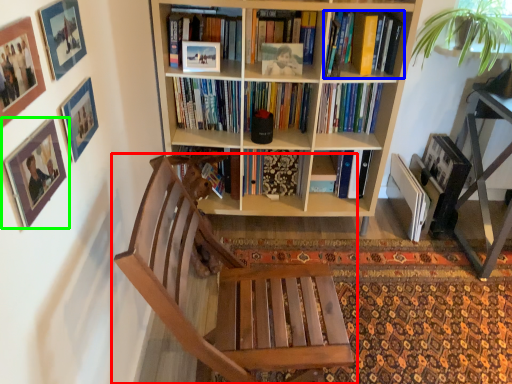
Question: Which object is positioned closest to chair (highlighted by a red box)? Select from book (highlighted by a blue box) and picture frame (highlighted by a green box).

Choices:
 (A) book
 (B) picture frame

Answer: (B)